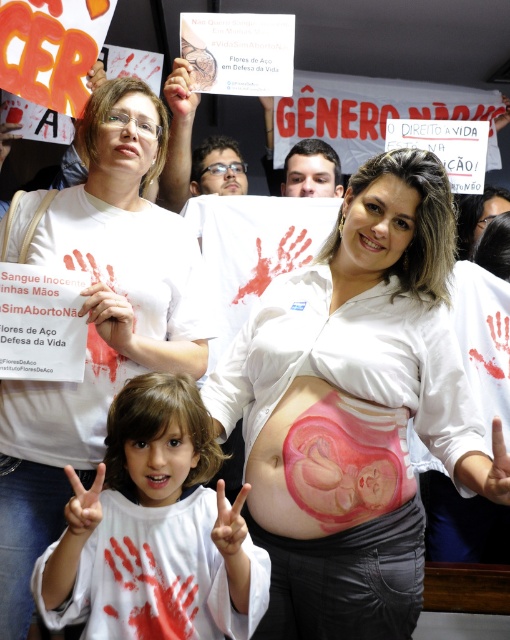
Does white paper hand at lower left have a lesser width compared to pink matte/soft baby at center?

In fact, white paper hand at lower left might be wider than pink matte/soft baby at center.

Can you confirm if white paper hand at lower left is positioned below pink matte/soft baby at center?

Yes.

What do you see at coordinates (155, 531) in the screenshot?
I see `white paper hand at lower left` at bounding box center [155, 531].

Locate an element on the screen. The image size is (510, 640). white paper hand at lower left is located at coordinates (155, 531).

Between pink glossy baby at center and pink matte/soft baby at center, which one is positioned higher?

pink glossy baby at center is above.

Is pink glossy baby at center to the left of pink matte/soft baby at center from the viewer's perspective?

Incorrect, pink glossy baby at center is not on the left side of pink matte/soft baby at center.

Which is in front, point (248, 474) or point (290, 456)?

Point (290, 456) is more forward.

Find the location of a particular element. This screenshot has height=640, width=510. pink glossy baby at center is located at coordinates (354, 408).

Does white matte shirt at center have a larger size compared to pink matte/soft baby at center?

Correct, white matte shirt at center is larger in size than pink matte/soft baby at center.

How far apart are white matte shirt at center and pink matte/soft baby at center?

The distance of white matte shirt at center from pink matte/soft baby at center is 18.98 inches.

Image resolution: width=510 pixels, height=640 pixels. What are the coordinates of `white matte shirt at center` in the screenshot? It's located at (97, 324).